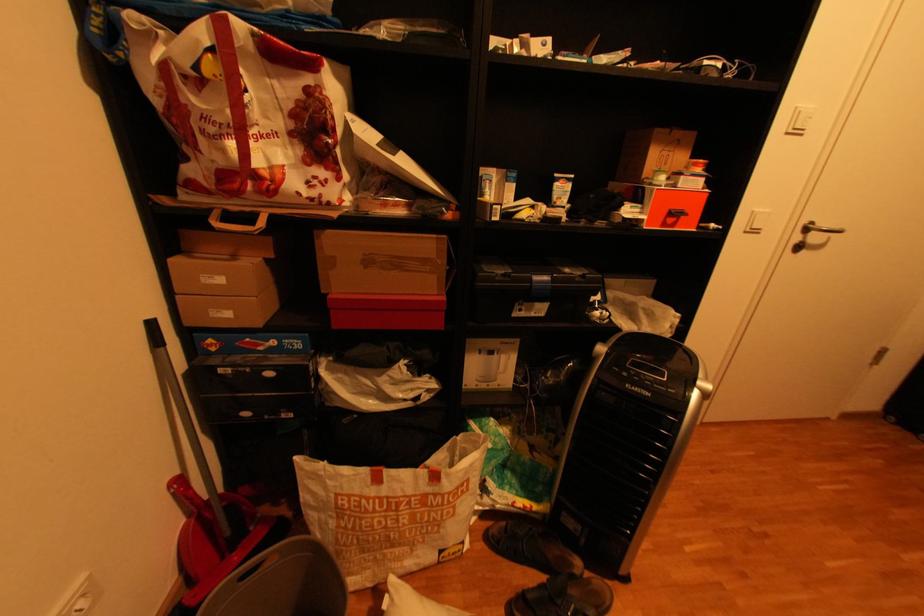
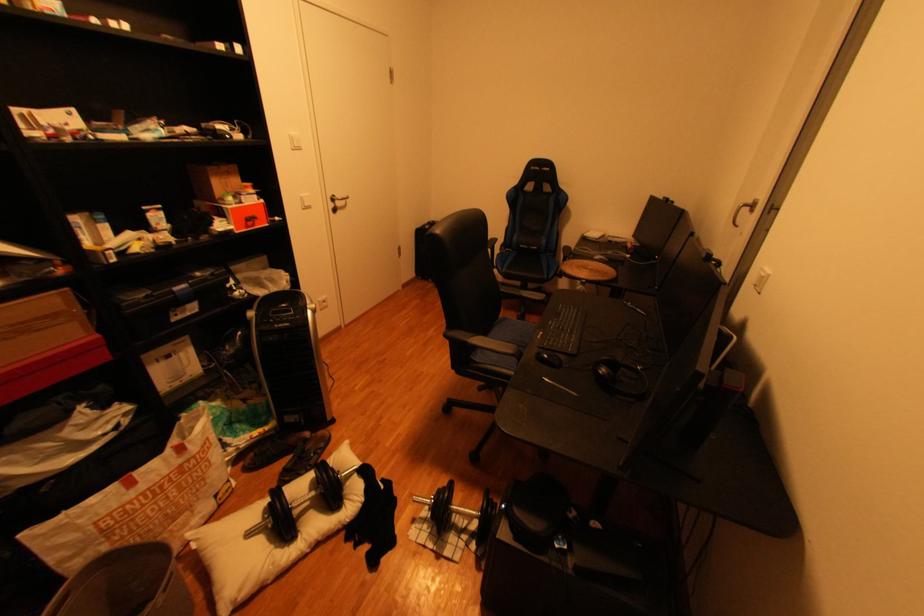
Find the pixel in the second image that matches pixel 675 154 in the first image.

(235, 182)